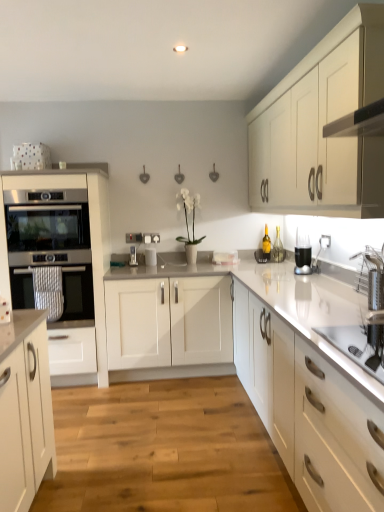
Where is `stainless steel oven at left, the first oven positioned from the bottom`? stainless steel oven at left, the first oven positioned from the bottom is located at coordinates (77, 293).

The width and height of the screenshot is (384, 512). Identify the location of black plastic blender at upper right. [303, 255].

Locate an element on the screen. This screenshot has height=512, width=384. wooden floor at center is located at coordinates (164, 450).

This screenshot has height=512, width=384. Describe the element at coordinates (322, 125) in the screenshot. I see `white matte cabinet at upper right, the 2th cabinetry positioned from the left` at that location.

Describe the element at coordinates (365, 322) in the screenshot. I see `stainless steel sink at lower right` at that location.

This screenshot has width=384, height=512. What do you see at coordinates (133, 256) in the screenshot?
I see `metallic silver toaster at center, the 2th appliance positioned from the right` at bounding box center [133, 256].

The width and height of the screenshot is (384, 512). Find the location of `stainless steel oven at left, the first oven positioned from the bottom`. stainless steel oven at left, the first oven positioned from the bottom is located at coordinates (77, 293).

Where is `sink in front of the black plastic blender at upper right`? sink in front of the black plastic blender at upper right is located at coordinates (365, 322).

Does black plastic blender at upper right have a larger size compared to stainless steel sink at lower right?

No, black plastic blender at upper right is not bigger than stainless steel sink at lower right.

Is black plastic blender at upper right shorter than stainless steel sink at lower right?

Incorrect, the height of black plastic blender at upper right does not fall short of that of stainless steel sink at lower right.

Is black plastic blender at upper right turned away from stainless steel sink at lower right?

That's not correct — black plastic blender at upper right is not looking away from stainless steel sink at lower right.

Is stainless steel oven at left, the 2th oven positioned from the top, in contact with stainless steel sink at lower right?

stainless steel oven at left, the 2th oven positioned from the top, and stainless steel sink at lower right are clearly separated.

Identify the location of sink that is in front of the stainless steel oven at left, the 2th oven positioned from the top. (365, 322).

Could you tell me if stainless steel oven at left, the 2th oven positioned from the top, is turned towards stainless steel sink at lower right?

No.

Considering the positions of objects stainless steel oven at left, the 2th oven positioned from the top, and stainless steel sink at lower right in the image provided, who is behind, stainless steel oven at left, the 2th oven positioned from the top, or stainless steel sink at lower right?

stainless steel oven at left, the 2th oven positioned from the top, is more distant.

Is stainless steel sink at lower right next to metallic silver toaster at center, the 2th appliance positioned from the right, and touching it?

No.

From the image's perspective, is stainless steel sink at lower right above metallic silver toaster at center, placed as the 1th appliance when sorted from left to right?

No.

Which is behind, point (337, 329) or point (133, 256)?

Point (133, 256)

Based on the photo, from a real-world perspective, which is physically below, stainless steel sink at lower right or metallic silver toaster at center, placed as the 1th appliance when sorted from left to right?

stainless steel sink at lower right is physically lower.

From the image's perspective, is satin white oven at left, placed as the first cabinetry when sorted from left to right, positioned above or below metallic silver toaster at center, the 2th appliance positioned from the right?

Based on their image positions, satin white oven at left, placed as the first cabinetry when sorted from left to right, is located beneath metallic silver toaster at center, the 2th appliance positioned from the right.

From a real-world perspective, which is physically below, satin white oven at left, placed as the first cabinetry when sorted from left to right, or metallic silver toaster at center, the 2th appliance positioned from the right?

From a 3D spatial view, satin white oven at left, placed as the first cabinetry when sorted from left to right, is below.

Considering the positions of objects satin white oven at left, the second cabinetry positioned from the right, and metallic silver toaster at center, placed as the 1th appliance when sorted from left to right, in the image provided, who is in front, satin white oven at left, the second cabinetry positioned from the right, or metallic silver toaster at center, placed as the 1th appliance when sorted from left to right,?

satin white oven at left, the second cabinetry positioned from the right.

Which object is thinner, satin white oven at left, the second cabinetry positioned from the right, or metallic silver toaster at center, the 2th appliance positioned from the right?

With smaller width is metallic silver toaster at center, the 2th appliance positioned from the right.

Which object is wider, metallic silver toaster at center, placed as the 1th appliance when sorted from left to right, or stainless steel oven at left, the first oven positioned from the bottom?

Wider between the two is stainless steel oven at left, the first oven positioned from the bottom.

Is metallic silver toaster at center, the 2th appliance positioned from the right, located outside stainless steel oven at left, the 2th oven positioned from the top?

metallic silver toaster at center, the 2th appliance positioned from the right, lies outside stainless steel oven at left, the 2th oven positioned from the top,'s area.

From a real-world perspective, who is located higher, metallic silver toaster at center, the 2th appliance positioned from the right, or stainless steel oven at left, the 2th oven positioned from the top?

metallic silver toaster at center, the 2th appliance positioned from the right, is physically above.

Is white matte cabinet at upper right, the 2th cabinetry positioned from the left, in contact with stainless steel sink at lower right?

No, white matte cabinet at upper right, the 2th cabinetry positioned from the left, is not touching stainless steel sink at lower right.

From the image's perspective, does white matte cabinet at upper right, which is the first cabinetry from right to left, appear lower than stainless steel sink at lower right?

No, from the image's perspective, white matte cabinet at upper right, which is the first cabinetry from right to left, is not beneath stainless steel sink at lower right.

The image size is (384, 512). Find the location of `cabinetry that is on the right side of stainless steel sink at lower right`. cabinetry that is on the right side of stainless steel sink at lower right is located at coordinates (322, 125).

Is white matte cabinet at upper right, which is the first cabinetry from right to left, inside the boundaries of stainless steel sink at lower right, or outside?

white matte cabinet at upper right, which is the first cabinetry from right to left, is not enclosed by stainless steel sink at lower right.

Can you confirm if satin black oven at left, the 2th oven from the bottom, is bigger than satin white oven at left, placed as the first cabinetry when sorted from left to right?

No.

Is point (42, 205) closer or farther from the camera than point (49, 185)?

Point (42, 205) is positioned farther from the camera compared to point (49, 185).

How many degrees apart are the facing directions of satin black oven at left, the 2th oven from the bottom, and satin white oven at left, placed as the first cabinetry when sorted from left to right?

0.797 degrees.

Which object is further away from the camera taking this photo, satin black oven at left, the 2th oven from the bottom, or satin white oven at left, the second cabinetry positioned from the right?

satin black oven at left, the 2th oven from the bottom, is behind.

You are a GUI agent. You are given a task and a screenshot of the screen. Output one action in this format:
    pyautogui.click(x=<x>, y=<y>)
    Task: Click on the kitchen appliance behind the stainless steel sink at lower right
    The width and height of the screenshot is (384, 512).
    Given the screenshot: What is the action you would take?
    pyautogui.click(x=303, y=255)

This screenshot has height=512, width=384. In order to click on sink that is in front of the stainless steel oven at left, the 2th oven positioned from the top in this screenshot , I will do `click(365, 322)`.

When comparing their distances from stainless steel sink at lower right, does white glossy electric kettle at center, the 2th appliance positioned from the left, or white matte cabinet at upper right, which is the first cabinetry from right to left, seem closer?

white matte cabinet at upper right, which is the first cabinetry from right to left.

Considering their positions, is stainless steel sink at lower right positioned closer to black plastic blender at upper right than white glossy electric kettle at center, the 2th appliance positioned from the left?

Among the two, stainless steel sink at lower right is located nearer to black plastic blender at upper right.

Estimate the real-world distances between objects in this image. Which object is further from metallic silver toaster at center, the 2th appliance positioned from the right, black plastic blender at upper right or stainless steel oven at left, the 2th oven positioned from the top?

black plastic blender at upper right is further to metallic silver toaster at center, the 2th appliance positioned from the right.

Looking at the image, which one is located closer to metallic silver toaster at center, the 2th appliance positioned from the right, wooden floor at center or stainless steel oven at left, the first oven positioned from the bottom?

Among the two, stainless steel oven at left, the first oven positioned from the bottom, is located nearer to metallic silver toaster at center, the 2th appliance positioned from the right.

Looking at the image, which one is located closer to white matte cabinet at upper right, the 2th cabinetry positioned from the left, wooden floor at center or stainless steel sink at lower right?

stainless steel sink at lower right is closer to white matte cabinet at upper right, the 2th cabinetry positioned from the left.

Based on their spatial positions, is white matte cabinet at upper right, the 2th cabinetry positioned from the left, or stainless steel oven at left, the first oven positioned from the bottom, closer to satin black oven at left, marked as the 1th oven in a top-to-bottom arrangement?

stainless steel oven at left, the first oven positioned from the bottom.

Considering their positions, is satin white oven at left, the second cabinetry positioned from the right, positioned further to white matte cabinet at upper right, the 2th cabinetry positioned from the left, than stainless steel oven at left, the first oven positioned from the bottom?

Among the two, stainless steel oven at left, the first oven positioned from the bottom, is located further to white matte cabinet at upper right, the 2th cabinetry positioned from the left.

When comparing their distances from white glossy electric kettle at center, the 2th appliance positioned from the left, does stainless steel sink at lower right or satin black oven at left, marked as the 1th oven in a top-to-bottom arrangement, seem further?

stainless steel sink at lower right lies further to white glossy electric kettle at center, the 2th appliance positioned from the left, than the other object.

In order to click on cabinetry between white matte cabinet at upper right, the 2th cabinetry positioned from the left, and white glossy electric kettle at center, which is the first appliance in right-to-left order, along the z-axis in this screenshot , I will do `click(90, 238)`.

Locate an element on the screen. The image size is (384, 512). plain situated between satin white oven at left, the second cabinetry positioned from the right, and black plastic blender at upper right from left to right is located at coordinates (164, 450).

Identify the location of plain between stainless steel sink at lower right and black plastic blender at upper right from front to back. The image size is (384, 512). (164, 450).

Locate an element on the screen. This screenshot has width=384, height=512. appliance positioned between white matte cabinet at upper right, the 2th cabinetry positioned from the left, and metallic silver toaster at center, placed as the 1th appliance when sorted from left to right, from near to far is located at coordinates (150, 255).